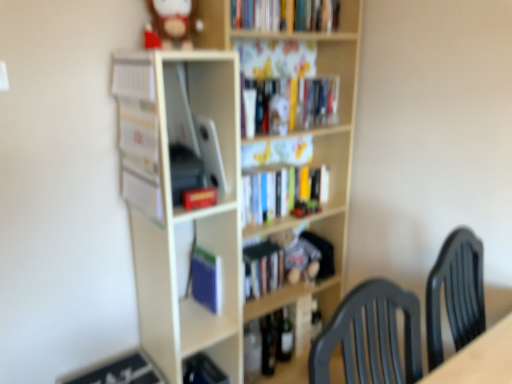
Describe the element at coordinates (263, 269) in the screenshot. I see `hardcover book at center, the second book ordered from the bottom` at that location.

Consider the image. Measure the distance between white matte bookshelf at center, marked as the second shelf in a right-to-left arrangement, and camera.

The depth of white matte bookshelf at center, marked as the second shelf in a right-to-left arrangement, is 1.23 meters.

The height and width of the screenshot is (384, 512). I want to click on wooden bookcase at center, so click(218, 184).

How much space does white paper at left, which appears as the fourth book when ordered from the bottom, occupy horizontally?

white paper at left, which appears as the fourth book when ordered from the bottom, is 3.53 centimeters wide.

The width and height of the screenshot is (512, 384). I want to click on hardcover book at center, the fifth book positioned from the top, so coord(263,269).

In the scene shown: Does black glass wine bottle at lower center, which is the first wine bottle in left-to-right order, turn towards hardcover book at center, the fifth book positioned from the top?

No, black glass wine bottle at lower center, which is the first wine bottle in left-to-right order, is not oriented towards hardcover book at center, the fifth book positioned from the top.

From a real-world perspective, which object rests below the other?

black glass wine bottle at lower center, which is the first wine bottle in left-to-right order, is physically lower.

Considering the positions of point (271, 346) and point (277, 260), is point (271, 346) closer or farther from the camera than point (277, 260)?

Point (271, 346) is closer to the camera than point (277, 260).

Is black glass wine bottle at lower center, which is the first wine bottle in left-to-right order, wider than hardcover book at center, the second book ordered from the bottom?

Incorrect, the width of black glass wine bottle at lower center, which is the first wine bottle in left-to-right order, does not surpass that of hardcover book at center, the second book ordered from the bottom.

Where is `cabinet on the left side of wooden bookcase at center`? This screenshot has height=384, width=512. cabinet on the left side of wooden bookcase at center is located at coordinates coord(119,371).

Is the depth of wooden bookcase at center greater than that of matte white cabinet at lower left?

No, wooden bookcase at center is in front of matte white cabinet at lower left.

Are wooden bookcase at center and matte white cabinet at lower left far apart?

That's not correct — wooden bookcase at center is a little close to matte white cabinet at lower left.

Would you say matte white cabinet at lower left is part of wooden bookcase at center's contents?

Answer: Actually, matte white cabinet at lower left is outside wooden bookcase at center.

Does shiny dark glass wine bottle at center, the 2th wine bottle in the left-to-right sequence, have a greater height compared to matte white cabinet at lower left?

Yes.

Is the position of shiny dark glass wine bottle at center, the 2th wine bottle in the left-to-right sequence, more distant than that of matte white cabinet at lower left?

Yes, shiny dark glass wine bottle at center, the 2th wine bottle in the left-to-right sequence, is behind matte white cabinet at lower left.

From the image's perspective, between shiny dark glass wine bottle at center, the 2th wine bottle in the left-to-right sequence, and matte white cabinet at lower left, who is located below?

From the image's view, matte white cabinet at lower left is below.

Does shiny dark glass wine bottle at center, the 2th wine bottle in the left-to-right sequence, appear on the left side of matte white cabinet at lower left?

Incorrect, shiny dark glass wine bottle at center, the 2th wine bottle in the left-to-right sequence, is not on the left side of matte white cabinet at lower left.

Considering the sizes of objects hardcover book at center, the second book ordered from the bottom, and matte red book at center, the 3th book ordered from the bottom, in the image provided, who is bigger, hardcover book at center, the second book ordered from the bottom, or matte red book at center, the 3th book ordered from the bottom,?

Bigger between the two is hardcover book at center, the second book ordered from the bottom.

From a real-world perspective, which object stands above the other?

In real-world perspective, matte red book at center, which is the fourth book in top-to-bottom order, is above.

Is hardcover book at center, the second book ordered from the bottom, taller or shorter than matte red book at center, the 3th book ordered from the bottom?

hardcover book at center, the second book ordered from the bottom, is taller than matte red book at center, the 3th book ordered from the bottom.

Is matte red book at center, which is the fourth book in top-to-bottom order, inside hardcover book at center, the fifth book positioned from the top?

No.

From the image's perspective, between hardcover books at upper center, which appears as the first book when viewed from the top, and white paper at left, the third book from the top, which one is located above?

hardcover books at upper center, which appears as the first book when viewed from the top.

From the image's perspective, count 2nd books upward from the white paper at left, the third book from the top, and point to it. Please provide its 2D coordinates.

[(285, 15)]

Do you think hardcover books at upper center, arranged as the 6th book when ordered from the bottom, is within white paper at left, the third book from the top, or outside of it?

hardcover books at upper center, arranged as the 6th book when ordered from the bottom, exists outside the volume of white paper at left, the third book from the top.

Which is more to the right, hardcover books at upper center, which appears as the first book when viewed from the top, or white paper at left, which appears as the fourth book when ordered from the bottom?

hardcover books at upper center, which appears as the first book when viewed from the top.

Considering the sizes of objects white paper at left, which appears as the fourth book when ordered from the bottom, and black glass wine bottle at lower center, the 2th wine bottle when ordered from right to left, in the image provided, who is taller, white paper at left, which appears as the fourth book when ordered from the bottom, or black glass wine bottle at lower center, the 2th wine bottle when ordered from right to left,?

With more height is white paper at left, which appears as the fourth book when ordered from the bottom.

From a real-world perspective, who is located lower, white paper at left, the third book from the top, or black glass wine bottle at lower center, the 2th wine bottle when ordered from right to left?

black glass wine bottle at lower center, the 2th wine bottle when ordered from right to left, from a real-world perspective.

Does point (155, 174) lie behind point (264, 372)?

No.

Can you confirm if hardcover books at upper center, arranged as the 6th book when ordered from the bottom, is positioned to the left of wooden bookshelf at center, the first shelf positioned from the right?

In fact, hardcover books at upper center, arranged as the 6th book when ordered from the bottom, is to the right of wooden bookshelf at center, the first shelf positioned from the right.

From a real-world perspective, relative to wooden bookshelf at center, the first shelf positioned from the right, is hardcover books at upper center, arranged as the 6th book when ordered from the bottom, vertically above or below?

From a real-world perspective, hardcover books at upper center, arranged as the 6th book when ordered from the bottom, is physically above wooden bookshelf at center, the first shelf positioned from the right.

Is hardcover books at upper center, arranged as the 6th book when ordered from the bottom, beside wooden bookshelf at center, which is the 2th shelf from left to right?

No.

Which wine bottle is the 1st one when counting from the right side of the hardcover book at center, the second book ordered from the bottom? Please provide its 2D coordinates.

[(268, 344)]

Locate an element on the screen. cabinet that appears behind the wooden bookcase at center is located at coordinates (119, 371).

Which object lies further to the anchor point black glass wine bottle at lower center, which is the first wine bottle in left-to-right order, matte red book at center, the 3th book ordered from the bottom, or white paper at left, the third book from the top?

Among the two, white paper at left, the third book from the top, is located further to black glass wine bottle at lower center, which is the first wine bottle in left-to-right order.

Considering their positions, is white matte bookshelf at center, marked as the second shelf in a right-to-left arrangement, positioned further to wooden bookshelf at center, which is the 2th shelf from left to right, than hardcover book at center, the fifth book positioned from the top?

Among the two, white matte bookshelf at center, marked as the second shelf in a right-to-left arrangement, is located further to wooden bookshelf at center, which is the 2th shelf from left to right.

Looking at the image, which one is located further to matte white cabinet at lower left, black glass wine bottle at lower center, the 2th wine bottle when ordered from right to left, or wooden bookcase at center?

black glass wine bottle at lower center, the 2th wine bottle when ordered from right to left, is positioned further to the anchor matte white cabinet at lower left.

Looking at the image, which one is located further to hardcover books at upper center, arranged as the 6th book when ordered from the bottom, shiny dark glass wine bottle at center, the 2th wine bottle in the left-to-right sequence, or brown plush toy at upper center, the 2th toy positioned from the right?

Among the two, shiny dark glass wine bottle at center, the 2th wine bottle in the left-to-right sequence, is located further to hardcover books at upper center, arranged as the 6th book when ordered from the bottom.

Looking at the image, which one is located closer to brown plush toy at upper center, the 2th toy from the back, wooden bookcase at center or fuzzy fabric teddy bear at center, the 1th toy from the right?

wooden bookcase at center.

Based on the photo, when comparing their distances from hardcover book at center, the fifth book positioned from the bottom, does matte black book at lower left, placed as the first book when sorted from bottom to top, or brown plush toy at upper center, the 2th toy from the back, seem further?

matte black book at lower left, placed as the first book when sorted from bottom to top, is further to hardcover book at center, the fifth book positioned from the bottom.

Looking at this image, estimate the real-world distances between objects in this image. Which object is closer to white paper at left, which appears as the fourth book when ordered from the bottom, matte red book at center, which is the fourth book in top-to-bottom order, or wooden bookcase at center?

Among the two, matte red book at center, which is the fourth book in top-to-bottom order, is located nearer to white paper at left, which appears as the fourth book when ordered from the bottom.

Considering their positions, is wooden bookshelf at center, the first shelf positioned from the right, positioned closer to fuzzy fabric teddy bear at center, placed as the first toy when sorted from back to front, than black glass wine bottle at lower center, which is the first wine bottle in left-to-right order?

black glass wine bottle at lower center, which is the first wine bottle in left-to-right order, lies closer to fuzzy fabric teddy bear at center, placed as the first toy when sorted from back to front, than the other object.

Find the location of a particular element. The height and width of the screenshot is (384, 512). toy between white paper at left, which appears as the fourth book when ordered from the bottom, and hardcover book at center, the 2th book viewed from the top, in the horizontal direction is located at coordinates (170, 24).

The width and height of the screenshot is (512, 384). I want to click on paperback book between matte red book at center, which is the fourth book in top-to-bottom order, and fuzzy fabric teddy bear at center, which appears as the 2th toy when viewed from the left, from front to back, so click(x=206, y=279).

I want to click on paperback book between white matte bookshelf at center, marked as the second shelf in a right-to-left arrangement, and matte white cabinet at lower left, in the vertical direction, so click(x=206, y=279).

Identify the location of bookcase between hardcover books at upper center, which appears as the first book when viewed from the top, and white matte bookshelf at center, the first shelf when ordered from left to right, vertically. (218, 184).